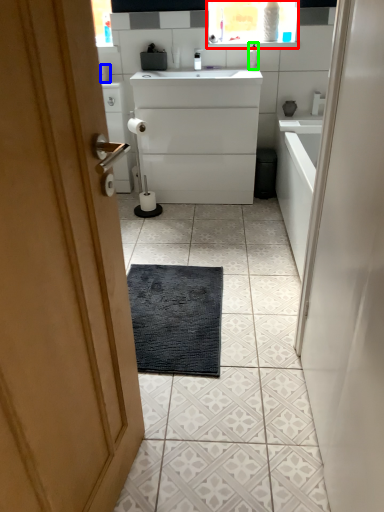
Question: Estimate the real-world distances between objects in this image. Which object is farther from medicine cabinet (highlighted by a red box), toilet paper (highlighted by a blue box) or toiletry (highlighted by a green box)?

Choices:
 (A) toilet paper
 (B) toiletry

Answer: (A)